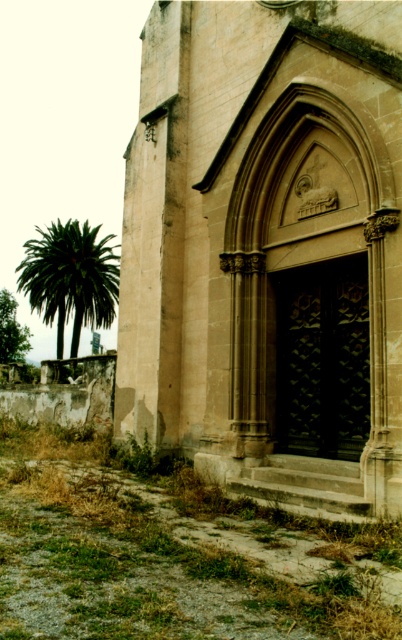
You are standing at the entrance of the historic building and want to take a photo of the point marked at coordinates (348, 221). Given that the camera you are using has a focal length of 50mm and the sensor size is 36mm wide, what is the minimum distance in meters you need to be from the point to ensure it fills the width of the photo?

Result: The point at coordinates (348, 221) is 32.62 meters away from the camera. To calculate the minimum distance required for the point to fill the width of the photo, use the formula distance > focal length multiplied by sensor width divided by subject size. However, since the subject size isn not provided, it is impossible to determine the exact distance needed.

You are standing in a garden and see the beige stone chapel at center and the green leafy palm at left. Which object is positioned more to the east if the chapel is facing north?

The green leafy palm at left is positioned more to the east since the chapel is facing north, meaning the left side of the chapel corresponds to the east direction.

You are standing in front of the beige stone chapel at center and the green leafy palm at left. Which one is shorter?

The beige stone chapel at center is shorter than the green leafy palm at left.